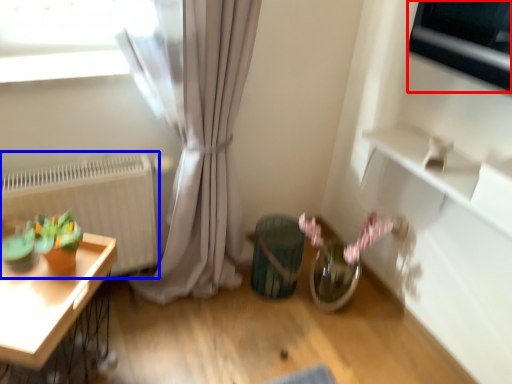
Question: Which point is further to the camera, appliance (highlighted by a red box) or radiator (highlighted by a blue box)?

Choices:
 (A) appliance
 (B) radiator

Answer: (B)